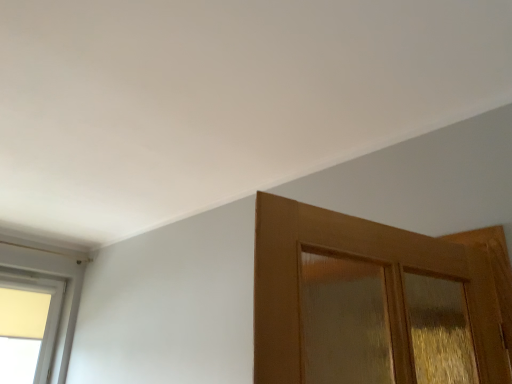
Find the location of `white matte window screen at lower left`. white matte window screen at lower left is located at coordinates (25, 331).

What do you see at coordinates (25, 331) in the screenshot? The width and height of the screenshot is (512, 384). I see `white matte window screen at lower left` at bounding box center [25, 331].

This screenshot has height=384, width=512. I want to click on white matte window screen at lower left, so click(25, 331).